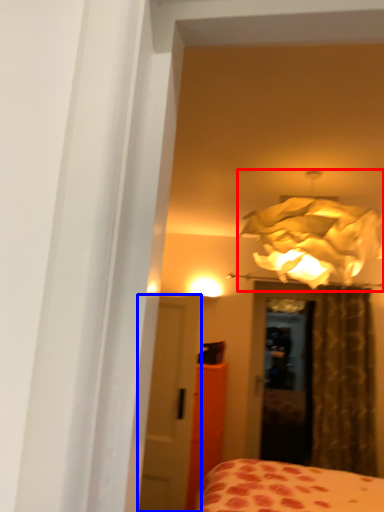
Question: Which object is further to the camera taking this photo, lamp (highlighted by a red box) or door (highlighted by a blue box)?

Choices:
 (A) lamp
 (B) door

Answer: (B)